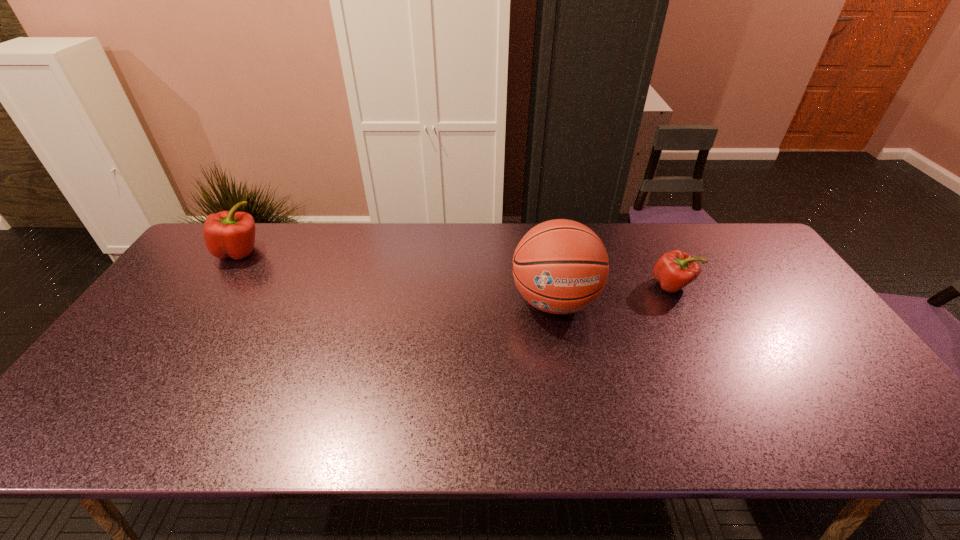
Where is `the tallest object`? The height and width of the screenshot is (540, 960). the tallest object is located at coordinates (560, 266).

Find the location of a particular element. The image size is (960, 540). basketball is located at coordinates (560, 266).

At what (x,y) coordinates should I click in order to perform the action: click on the farthest object. Please return your answer as a coordinate pair (x, y). Looking at the image, I should click on click(231, 234).

Identify the location of the taller bell pepper. (231, 234).

Where is `the shorter bell pepper`? the shorter bell pepper is located at coordinates (675, 270).

This screenshot has width=960, height=540. Find the location of `the nearer bell pepper`. the nearer bell pepper is located at coordinates (675, 270).

Locate an element on the screen. vacant point located on the logo side of the tallest object is located at coordinates (566, 364).

The width and height of the screenshot is (960, 540). In order to click on vacant region located on the front of the farthest object in this screenshot , I will do `click(210, 295)`.

Locate an element on the screen. This screenshot has height=540, width=960. free space located on the left of the rightmost object is located at coordinates (538, 286).

Identify the location of object positioned at the far edge. (231, 234).